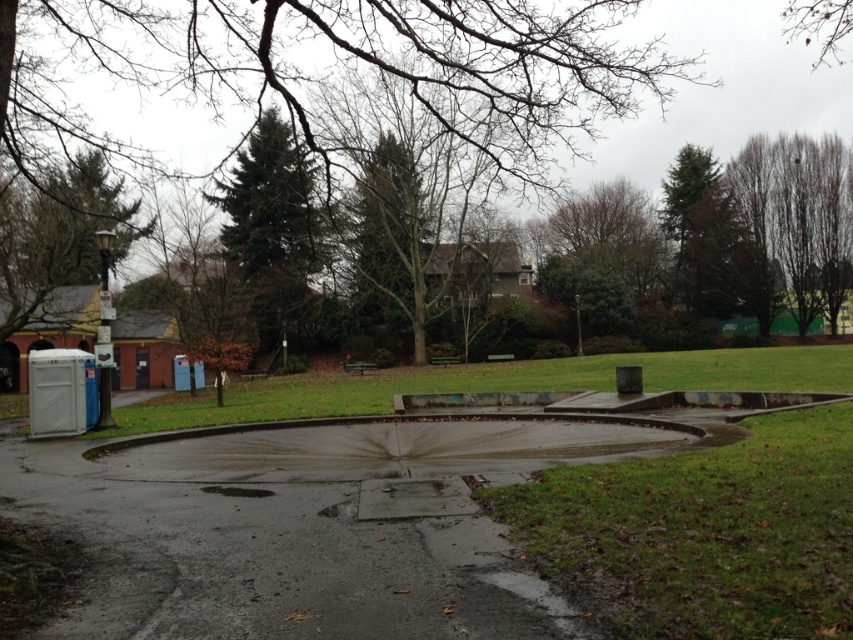
Is point (306, 250) more distant than point (68, 240)?

Yes, point (306, 250) is farther from viewer.

Is green textured tree at upper center below green textured tree at upper left?

Actually, green textured tree at upper center is above green textured tree at upper left.

Is point (281, 244) positioned after point (61, 205)?

Yes, point (281, 244) is behind point (61, 205).

Locate an element on the screen. The height and width of the screenshot is (640, 853). green textured tree at upper center is located at coordinates point(273,228).

Can you confirm if green textured tree at upper center is taller than brown leafy tree at upper right?

Yes, green textured tree at upper center is taller than brown leafy tree at upper right.

Does green textured tree at upper center have a smaller size compared to brown leafy tree at upper right?

Incorrect, green textured tree at upper center is not smaller in size than brown leafy tree at upper right.

Locate an element on the screen. green textured tree at upper center is located at coordinates (273, 228).

Locate an element on the screen. This screenshot has height=640, width=853. green textured tree at upper center is located at coordinates (273, 228).

Between green textured tree at upper left and brown leafy tree at upper right, which one has more height?

Standing taller between the two is brown leafy tree at upper right.

Can you confirm if green textured tree at upper left is smaller than brown leafy tree at upper right?

No, green textured tree at upper left is not smaller than brown leafy tree at upper right.

This screenshot has width=853, height=640. What do you see at coordinates (56, 234) in the screenshot?
I see `green textured tree at upper left` at bounding box center [56, 234].

Where is `green textured tree at upper left`? The height and width of the screenshot is (640, 853). green textured tree at upper left is located at coordinates (56, 234).